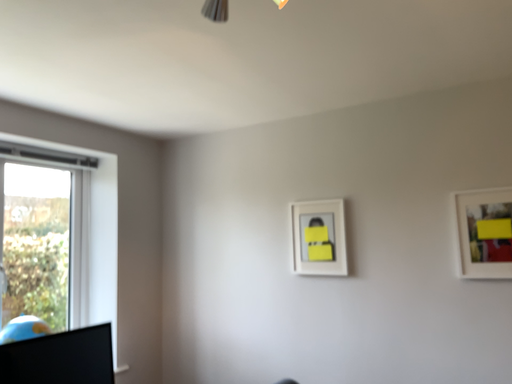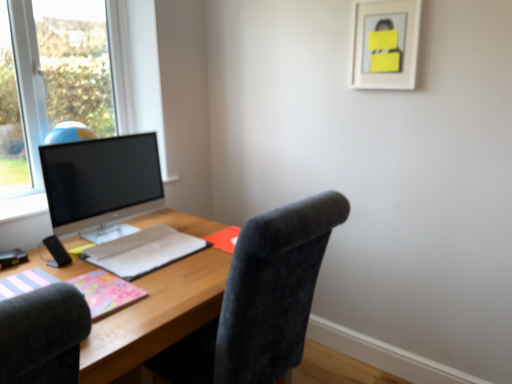
Question: How did the camera likely rotate when shooting the video?

Choices:
 (A) rotated left
 (B) rotated right

Answer: (A)